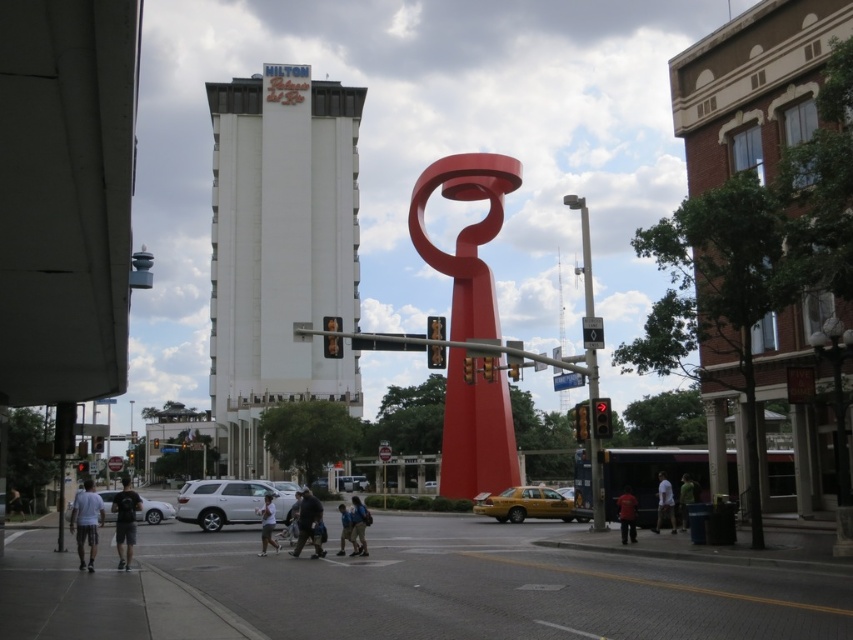
Question: Estimate the real-world distances between objects in this image. Which object is farther from the green fabric shirt at lower right?

Choices:
 (A) light brown leather jacket at center
 (B) white smooth building at upper center
 (C) dark blue backpack at center

Answer: (B)

Question: Based on their relative distances, which object is nearer to the green fabric shirt at lower right?

Choices:
 (A) light brown leather jacket at center
 (B) light gray t-shirt at lower left

Answer: (A)

Question: Which of the following is the closest to the observer?

Choices:
 (A) [x=125, y=554]
 (B) [x=585, y=244]
 (C) [x=666, y=504]

Answer: (A)

Question: Considering the relative positions of dark gray pants at lower center and red matte shirt at center in the image provided, where is dark gray pants at lower center located with respect to red matte shirt at center?

Choices:
 (A) right
 (B) left

Answer: (B)

Question: Does light gray t-shirt at lower left appear under dark blue backpack at center?

Choices:
 (A) yes
 (B) no

Answer: (B)

Question: Does dark gray shirt at lower right come in front of light brown leather jacket at center?

Choices:
 (A) yes
 (B) no

Answer: (B)